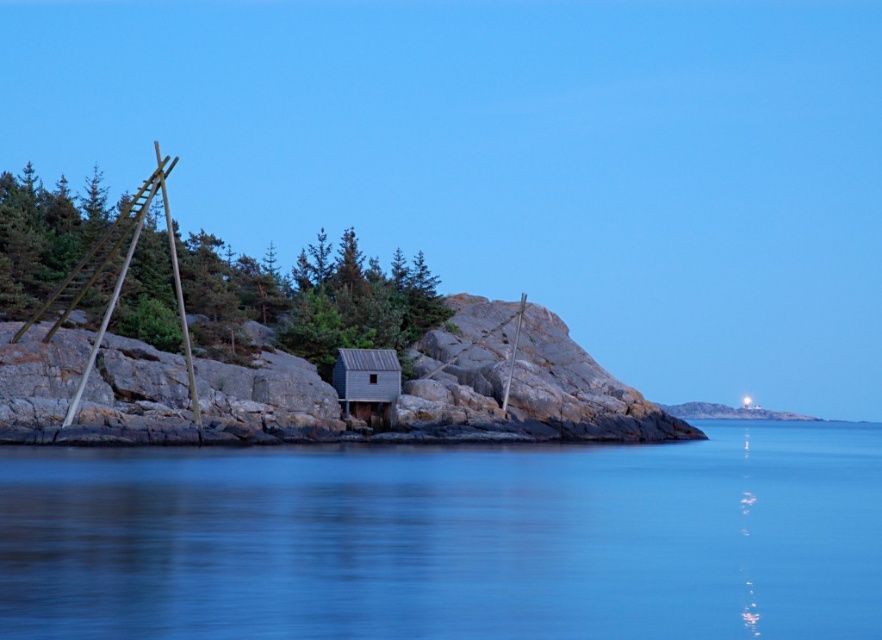
Question: Can you confirm if blue smooth water at center is positioned to the right of wooden cabin at center?

Choices:
 (A) no
 (B) yes

Answer: (B)

Question: Which of the following is the farthest from the observer?

Choices:
 (A) (383, 372)
 (B) (460, 532)

Answer: (A)

Question: Does blue smooth water at center appear on the right side of wooden cabin at center?

Choices:
 (A) no
 (B) yes

Answer: (B)

Question: Which object is closer to the camera taking this photo?

Choices:
 (A) blue smooth water at center
 (B) wooden cabin at center

Answer: (A)

Question: Which object appears closest to the camera in this image?

Choices:
 (A) wooden cabin at center
 (B) blue smooth water at center

Answer: (B)

Question: Is blue smooth water at center thinner than wooden cabin at center?

Choices:
 (A) yes
 (B) no

Answer: (B)